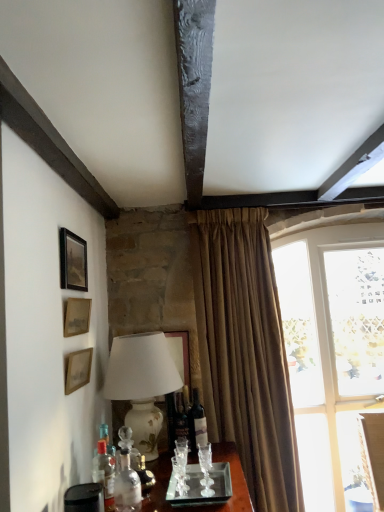
Measure the distance between point (190, 430) and camera.

Point (190, 430) is 6.87 feet from camera.

Measure the distance between white ceramic lamp at left and camera.

white ceramic lamp at left and camera are 1.94 meters apart.

I want to click on beige textured curtain at center, so click(245, 352).

What are the coordinates of `wooden picture frame at left, the third picture frame from the top` in the screenshot? It's located at (78, 370).

In order to face matte gold picture frame at upper left, placed as the second picture frame when sorted from bottom to top, should I rotate leftwards or rightwards?

Rotate your view left by about 14.947°.

Where is `matte black picture frame at upper left, the 3th picture frame positioned from the bottom`? The image size is (384, 512). matte black picture frame at upper left, the 3th picture frame positioned from the bottom is located at coordinates (73, 261).

I want to click on matte glass wine bottle at center, so click(197, 423).

Is translucent glass wine bottle at center, the third bottle in the front-to-back sequence, at the left side of white ceramic lamp at left?

No.

Considering the sizes of translucent glass wine bottle at center, which is counted as the first bottle, starting from the back, and white ceramic lamp at left in the image, is translucent glass wine bottle at center, which is counted as the first bottle, starting from the back, wider or thinner than white ceramic lamp at left?

Clearly, translucent glass wine bottle at center, which is counted as the first bottle, starting from the back, has less width compared to white ceramic lamp at left.

Can you see translucent glass wine bottle at center, the third bottle in the front-to-back sequence, touching white ceramic lamp at left?

No, translucent glass wine bottle at center, the third bottle in the front-to-back sequence, is not next to white ceramic lamp at left.

In the image, is translucent glass wine bottle at center, which is the first bottle from right to left, positioned in front of or behind white ceramic lamp at left?

In the image, translucent glass wine bottle at center, which is the first bottle from right to left, appears behind white ceramic lamp at left.

Between beige textured curtain at center and clear glass window at right, which one has more height?

clear glass window at right.

Is point (242, 460) closer to viewer compared to point (341, 500)?

Yes, point (242, 460) is in front of point (341, 500).

From a real-world perspective, between beige textured curtain at center and clear glass window at right, who is vertically higher?

beige textured curtain at center, from a real-world perspective.

Can you tell me how much white ceramic lamp at left and matte black picture frame at upper left, the 3th picture frame positioned from the bottom, differ in facing direction?

The angular difference between white ceramic lamp at left and matte black picture frame at upper left, the 3th picture frame positioned from the bottom, is 3.31 degrees.

From the image's perspective, relative to matte black picture frame at upper left, which appears as the first picture frame when viewed from the top, is white ceramic lamp at left above or below?

white ceramic lamp at left is situated lower than matte black picture frame at upper left, which appears as the first picture frame when viewed from the top, in the image.

Considering the sizes of white ceramic lamp at left and matte black picture frame at upper left, the 3th picture frame positioned from the bottom, in the image, is white ceramic lamp at left wider or thinner than matte black picture frame at upper left, the 3th picture frame positioned from the bottom,?

In the image, white ceramic lamp at left appears to be wider than matte black picture frame at upper left, the 3th picture frame positioned from the bottom.

Which is behind, point (163, 340) or point (73, 234)?

The point (163, 340) is more distant.

From the image's perspective, which is below, beige textured curtain at center or wooden picture frame at left, arranged as the 1th picture frame when ordered from the bottom?

beige textured curtain at center.

Who is shorter, beige textured curtain at center or wooden picture frame at left, arranged as the 1th picture frame when ordered from the bottom?

With less height is wooden picture frame at left, arranged as the 1th picture frame when ordered from the bottom.

Looking at the image, does beige textured curtain at center seem bigger or smaller compared to wooden picture frame at left, arranged as the 1th picture frame when ordered from the bottom?

beige textured curtain at center is bigger than wooden picture frame at left, arranged as the 1th picture frame when ordered from the bottom.

In the image, is beige textured curtain at center on the left side or the right side of matte gold picture frame at upper left, placed as the second picture frame when sorted from bottom to top?

In the image, beige textured curtain at center appears on the right side of matte gold picture frame at upper left, placed as the second picture frame when sorted from bottom to top.

Is point (276, 448) closer or farther from the camera than point (88, 315)?

Point (276, 448) is positioned farther from the camera compared to point (88, 315).

Between beige textured curtain at center and matte gold picture frame at upper left, the 2th picture frame positioned from the top, which one has larger width?

beige textured curtain at center.

From a real-world perspective, between wooden picture frame at left, the third picture frame from the top, and clear glass bottle at lower left, which appears as the 2th bottle when viewed from the front, who is vertically higher?

From a 3D spatial view, wooden picture frame at left, the third picture frame from the top, is above.

Is wooden picture frame at left, arranged as the 1th picture frame when ordered from the bottom, thinner than clear glass bottle at lower left, which appears as the 2th bottle when viewed from the front?

Indeed, wooden picture frame at left, arranged as the 1th picture frame when ordered from the bottom, has a lesser width compared to clear glass bottle at lower left, which appears as the 2th bottle when viewed from the front.

How many degrees apart are the facing directions of wooden picture frame at left, arranged as the 1th picture frame when ordered from the bottom, and clear glass bottle at lower left, the 1th bottle in the left-to-right sequence?

The facing directions of wooden picture frame at left, arranged as the 1th picture frame when ordered from the bottom, and clear glass bottle at lower left, the 1th bottle in the left-to-right sequence, are 0.304 degrees apart.

Which object is further away from the camera, matte gold picture frame at upper left, placed as the second picture frame when sorted from bottom to top, or translucent glass wine bottle at center, the 3th bottle from the left?

translucent glass wine bottle at center, the 3th bottle from the left.

Is matte gold picture frame at upper left, placed as the second picture frame when sorted from bottom to top, situated inside translucent glass wine bottle at center, which is counted as the first bottle, starting from the back, or outside?

matte gold picture frame at upper left, placed as the second picture frame when sorted from bottom to top, lies outside translucent glass wine bottle at center, which is counted as the first bottle, starting from the back.

From the image's perspective, relative to translucent glass wine bottle at center, which is the first bottle from right to left, is matte gold picture frame at upper left, the 2th picture frame positioned from the top, above or below?

matte gold picture frame at upper left, the 2th picture frame positioned from the top, is situated higher than translucent glass wine bottle at center, which is the first bottle from right to left, in the image.

Who is bigger, matte gold picture frame at upper left, the 2th picture frame positioned from the top, or translucent glass wine bottle at center, which is counted as the first bottle, starting from the back?

Bigger between the two is translucent glass wine bottle at center, which is counted as the first bottle, starting from the back.

From the image's perspective, which bottle is the 3rd one below the white ceramic lamp at left? Please provide its 2D coordinates.

[(180, 419)]

Find the location of `curtain located above the clear glass window at right (from the image's perspective)`. curtain located above the clear glass window at right (from the image's perspective) is located at coordinates (245, 352).

Based on their spatial positions, is matte gold picture frame at upper left, the 2th picture frame positioned from the top, or wooden picture frame at left, the third picture frame from the top, closer to translucent glass wine bottle at center, the third bottle in the front-to-back sequence?

wooden picture frame at left, the third picture frame from the top, is closer to translucent glass wine bottle at center, the third bottle in the front-to-back sequence.

Which object lies further to the anchor point matte glass wine bottle at center, beige textured curtain at center or clear glass bottle at lower left, which appears as the second bottle when viewed from the back?

clear glass bottle at lower left, which appears as the second bottle when viewed from the back.

From the image, which object appears to be farther from clear glass bottle at lower center, acting as the 3th bottle starting from the back, white ceramic lamp at left or matte gold picture frame at upper left, the 2th picture frame positioned from the top?

matte gold picture frame at upper left, the 2th picture frame positioned from the top.

When comparing their distances from clear glass window at right, does white ceramic lamp at left or wooden picture frame at left, arranged as the 1th picture frame when ordered from the bottom, seem further?

wooden picture frame at left, arranged as the 1th picture frame when ordered from the bottom.

Which object lies nearer to the anchor point wooden picture frame at left, the third picture frame from the top, clear glass bottle at lower center, positioned as the 1th bottle in front-to-back order, or matte gold picture frame at upper left, the 2th picture frame positioned from the top?

Among the two, matte gold picture frame at upper left, the 2th picture frame positioned from the top, is located nearer to wooden picture frame at left, the third picture frame from the top.

Which object lies further to the anchor point wooden picture frame at left, arranged as the 1th picture frame when ordered from the bottom, matte glass wine bottle at center or translucent glass wine bottle at center, the 3th bottle from the left?

matte glass wine bottle at center.

Looking at the image, which one is located closer to wooden picture frame at left, arranged as the 1th picture frame when ordered from the bottom, translucent glass wine bottle at center, the 3th bottle from the left, or clear glass bottle at lower left, which appears as the second bottle when viewed from the back?

clear glass bottle at lower left, which appears as the second bottle when viewed from the back, is positioned closer to the anchor wooden picture frame at left, arranged as the 1th picture frame when ordered from the bottom.

Which object lies further to the anchor point white ceramic lamp at left, clear glass bottle at lower left, the 1th bottle in the left-to-right sequence, or translucent glass wine bottle at center, the third bottle in the front-to-back sequence?

clear glass bottle at lower left, the 1th bottle in the left-to-right sequence, is positioned further to the anchor white ceramic lamp at left.

Identify the location of curtain between matte black picture frame at upper left, the 3th picture frame positioned from the bottom, and translucent glass wine bottle at center, which is the first bottle from right to left, in the vertical direction. Image resolution: width=384 pixels, height=512 pixels. (245, 352).

Image resolution: width=384 pixels, height=512 pixels. Find the location of `wine bottle that lies between matte black picture frame at upper left, which appears as the first picture frame when viewed from the top, and translucent glass wine bottle at center, which is the first bottle from right to left, from top to bottom`. wine bottle that lies between matte black picture frame at upper left, which appears as the first picture frame when viewed from the top, and translucent glass wine bottle at center, which is the first bottle from right to left, from top to bottom is located at coordinates (197, 423).

I want to click on lamp situated between matte gold picture frame at upper left, the 2th picture frame positioned from the top, and beige textured curtain at center from left to right, so click(x=142, y=384).

This screenshot has height=512, width=384. In order to click on lamp between clear glass bottle at lower left, which appears as the 3th bottle when viewed from the right, and clear glass window at right in this screenshot , I will do `click(142, 384)`.